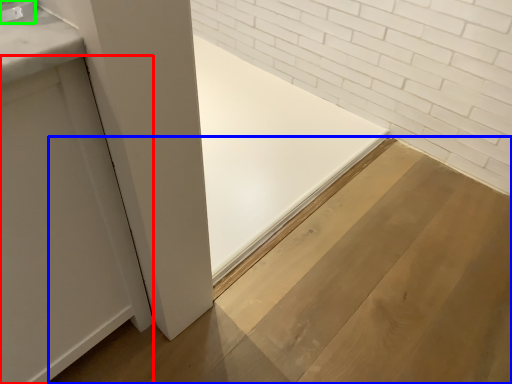
Question: Considering the real-world distances, which object is farthest from door (highlighted by a red box)? plywood (highlighted by a blue box) or faucet (highlighted by a green box)?

Choices:
 (A) plywood
 (B) faucet

Answer: (A)